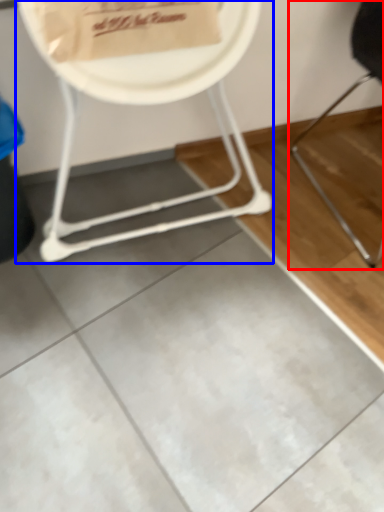
Question: Which object appears closest to the camera in this image, chair (highlighted by a red box) or chair (highlighted by a blue box)?

Choices:
 (A) chair
 (B) chair

Answer: (B)